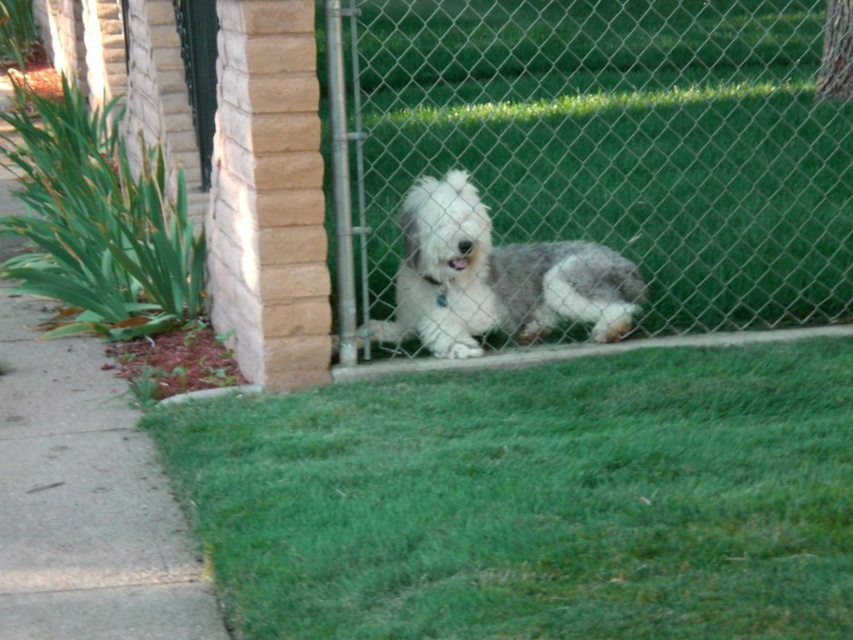
Question: Is gray concrete sidewalk at lower left bigger than white fluffy dog at center?

Choices:
 (A) yes
 (B) no

Answer: (A)

Question: Among these objects, which one is farthest from the camera?

Choices:
 (A) metal chain-link fence at center
 (B) green grass at lower center
 (C) green leafy grass at lower left

Answer: (C)

Question: Which point is closer to the camera?

Choices:
 (A) green grass at lower center
 (B) green leafy grass at lower left
 (C) metal chain-link fence at center

Answer: (A)

Question: Is metal chain-link fence at center positioned at the back of gray concrete sidewalk at lower left?

Choices:
 (A) no
 (B) yes

Answer: (A)

Question: Considering the relative positions of green grass at lower center and gray concrete sidewalk at lower left in the image provided, where is green grass at lower center located with respect to gray concrete sidewalk at lower left?

Choices:
 (A) below
 (B) above

Answer: (A)

Question: Estimate the real-world distances between objects in this image. Which object is closer to the white fluffy dog at center?

Choices:
 (A) metal chain-link fence at center
 (B) green grass at lower center
 (C) gray concrete sidewalk at lower left
 (D) green leafy grass at lower left

Answer: (B)